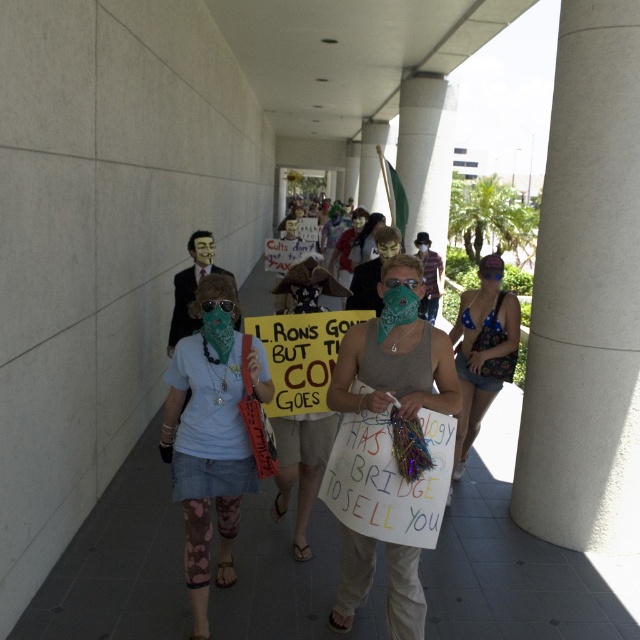
You are a photographer trying to capture the protest scene. You notice the green bandana at center and the blue bikini top at right. Which object should you focus on first if you want to photograph the one that is positioned more to the left?

The green bandana at center is positioned to the left of the blue bikini top at right, so you should focus on the green bandana at center first.

You are a photographer trying to capture the protest scene. You notice the green bandana at center and the blue bikini top at right. Which item appears narrower in the image?

The green bandana at center is thinner than the blue bikini top at right, so the green bandana at center appears narrower in the image.